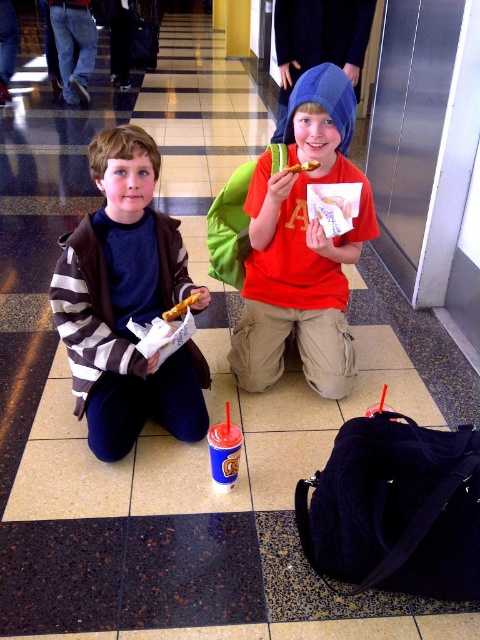
Is red matte shirt at center below golden crispy bread at center?

No, red matte shirt at center is not below golden crispy bread at center.

The image size is (480, 640). What are the coordinates of `red matte shirt at center` in the screenshot? It's located at point(301,248).

Who is positioned more to the left, golden crispy bread at center or yellow matte french fry at center?

golden crispy bread at center

Between point (171, 314) and point (308, 166), which one is positioned behind?

Positioned behind is point (308, 166).

Who is more forward, (192, 292) or (309, 163)?

Point (192, 292) is more forward.

This screenshot has width=480, height=640. What are the coordinates of `golden crispy bread at center` in the screenshot? It's located at (180, 307).

Which is behind, point (103, 358) or point (348, 385)?

Positioned behind is point (348, 385).

Is point (163, 419) positioned before point (262, 374)?

Yes, it is.

Where is `striped fabric jacket at left`? striped fabric jacket at left is located at coordinates (127, 304).